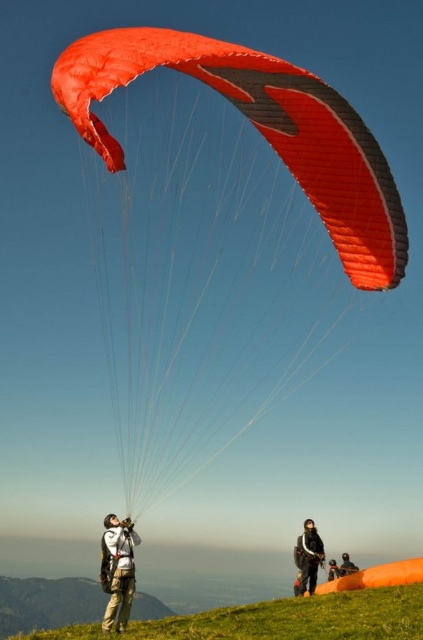
Who is positioned more to the right, green grassy field at lower center or orange fabric parachute at upper center?

From the viewer's perspective, orange fabric parachute at upper center appears more on the right side.

Which is behind, point (302, 616) or point (351, 572)?

The point (351, 572) is more distant.

This screenshot has height=640, width=423. I want to click on green grassy field at lower center, so click(x=302, y=618).

Which of these two, green grassy field at lower center or black matte helmet at upper center, stands shorter?

black matte helmet at upper center

Between green grassy field at lower center and black matte helmet at upper center, which one has more height?

green grassy field at lower center is taller.

This screenshot has width=423, height=640. In order to click on green grassy field at lower center in this screenshot , I will do `click(302, 618)`.

Can you confirm if green grassy field at lower center is positioned above white fabric parachute at upper center?

No.

Is green grassy field at lower center thinner than white fabric parachute at upper center?

Incorrect, green grassy field at lower center's width is not less than white fabric parachute at upper center's.

Between point (90, 628) and point (115, 568), which one is positioned in front?

Point (115, 568) is more forward.

Identify the location of green grassy field at lower center. The height and width of the screenshot is (640, 423). (302, 618).